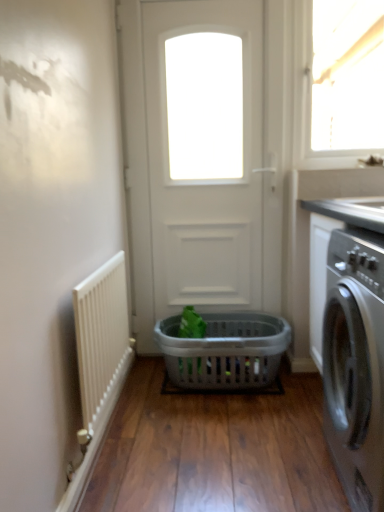
Question: Is satin black washing machine at right completely or partially outside of white textured radiator at left?

Choices:
 (A) no
 (B) yes

Answer: (B)

Question: Could you tell me if satin black washing machine at right is facing white textured radiator at left?

Choices:
 (A) no
 (B) yes

Answer: (B)

Question: Does satin black washing machine at right have a greater width compared to white textured radiator at left?

Choices:
 (A) yes
 (B) no

Answer: (A)

Question: From a real-world perspective, is satin black washing machine at right located beneath white textured radiator at left?

Choices:
 (A) yes
 (B) no

Answer: (B)

Question: Does satin black washing machine at right have a smaller size compared to white textured radiator at left?

Choices:
 (A) yes
 (B) no

Answer: (B)

Question: From a real-world perspective, is satin black washing machine at right physically located above or below gray plastic basket at center?

Choices:
 (A) above
 (B) below

Answer: (A)

Question: Looking at the image, does satin black washing machine at right seem bigger or smaller compared to gray plastic basket at center?

Choices:
 (A) big
 (B) small

Answer: (A)

Question: Is point (349, 473) closer or farther from the camera than point (256, 373)?

Choices:
 (A) closer
 (B) farther

Answer: (A)

Question: Considering the positions of satin black washing machine at right and gray plastic basket at center in the image, is satin black washing machine at right wider or thinner than gray plastic basket at center?

Choices:
 (A) wide
 (B) thin

Answer: (B)

Question: From a real-world perspective, is white textured radiator at left physically located above or below gray plastic basket at center?

Choices:
 (A) below
 (B) above

Answer: (B)

Question: Considering the positions of white textured radiator at left and gray plastic basket at center in the image, is white textured radiator at left bigger or smaller than gray plastic basket at center?

Choices:
 (A) small
 (B) big

Answer: (A)

Question: In terms of height, does white textured radiator at left look taller or shorter compared to gray plastic basket at center?

Choices:
 (A) tall
 (B) short

Answer: (A)

Question: From the image's perspective, is white textured radiator at left positioned above or below gray plastic basket at center?

Choices:
 (A) below
 (B) above

Answer: (B)

Question: In terms of height, does white textured radiator at left look taller or shorter compared to white matte door at center?

Choices:
 (A) tall
 (B) short

Answer: (B)

Question: Looking at the image, does white textured radiator at left seem bigger or smaller compared to white matte door at center?

Choices:
 (A) big
 (B) small

Answer: (B)